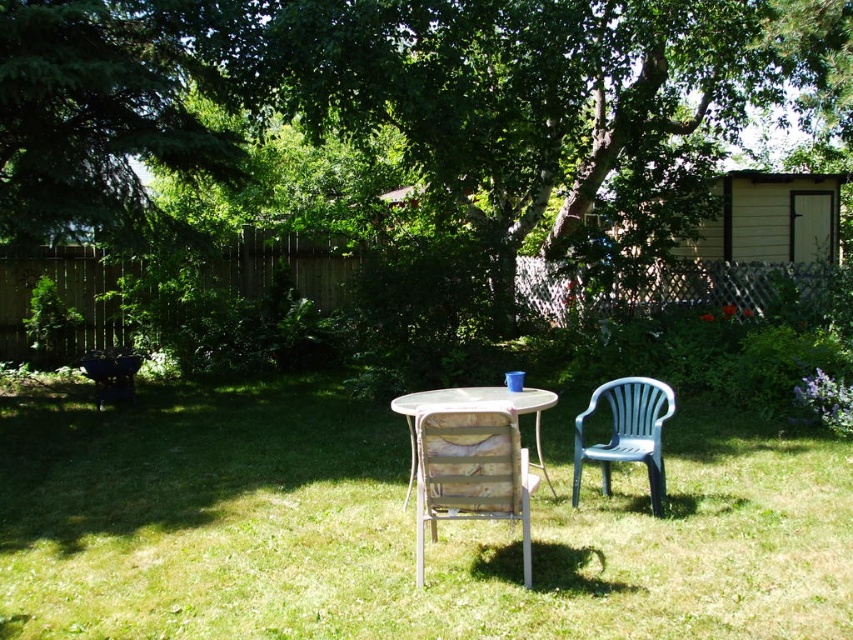
Is green leafy tree at center bigger than wooden table at center?

Indeed, green leafy tree at center has a larger size compared to wooden table at center.

Does green leafy tree at center appear under wooden table at center?

Incorrect, green leafy tree at center is not positioned below wooden table at center.

Is point (578, 102) in front of point (410, 472)?

No, it is behind (410, 472).

Identify the location of green leafy tree at center. This screenshot has height=640, width=853. (418, 100).

From the picture: Is green grass at center smaller than green leafy tree at center?

Yes.

Measure the distance from green grass at center to green leafy tree at center.

They are 7.64 meters apart.

Is point (97, 580) more distant than point (120, 184)?

No.

Identify the location of green grass at center. This screenshot has height=640, width=853. (398, 529).

Does wooden slatted chair at center have a larger size compared to wooden table at center?

No, wooden slatted chair at center is not bigger than wooden table at center.

Who is more distant from viewer, (508, 483) or (537, 432)?

Point (537, 432)

You are a GUI agent. You are given a task and a screenshot of the screen. Output one action in this format:
    pyautogui.click(x=<x>, y=<y>)
    Task: Click on the wooden slatted chair at center
    
    Given the screenshot: What is the action you would take?
    pyautogui.click(x=469, y=470)